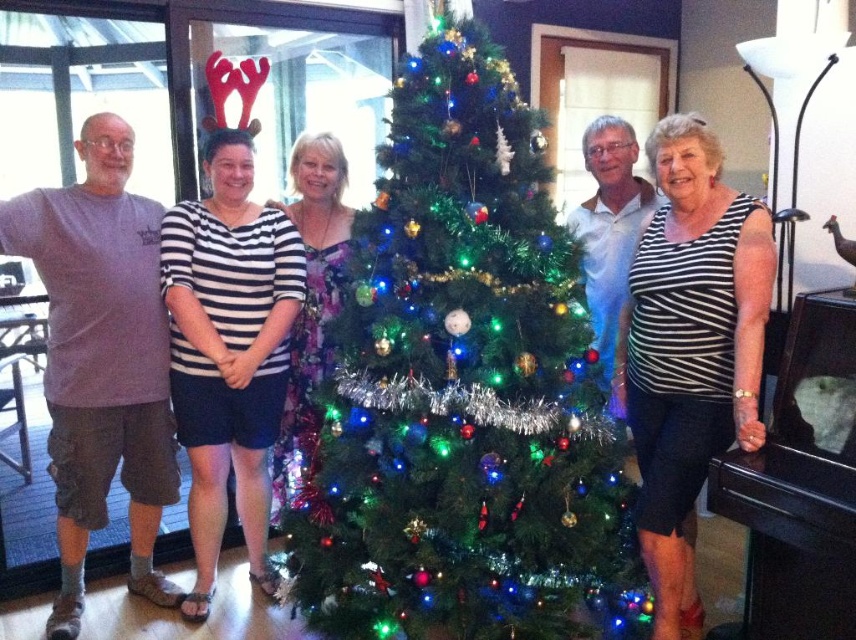
Which is above, purple cotton t-shirt at left or black striped tank top at right?

Positioned higher is purple cotton t-shirt at left.

Locate an element on the screen. The width and height of the screenshot is (856, 640). purple cotton t-shirt at left is located at coordinates (100, 358).

Locate an element on the screen. purple cotton t-shirt at left is located at coordinates (100, 358).

This screenshot has height=640, width=856. I want to click on purple cotton t-shirt at left, so (100, 358).

Is green shiny christmas tree at center thinner than striped fabric shirt at center?

No.

Looking at this image, can you confirm if green shiny christmas tree at center is positioned to the left of striped fabric shirt at center?

Incorrect, green shiny christmas tree at center is not on the left side of striped fabric shirt at center.

Where is `green shiny christmas tree at center`? This screenshot has width=856, height=640. green shiny christmas tree at center is located at coordinates (462, 390).

Is black striped tank top at right above striped fabric shirt at center?

Incorrect, black striped tank top at right is not positioned above striped fabric shirt at center.

Does black striped tank top at right have a lesser width compared to striped fabric shirt at center?

Indeed, black striped tank top at right has a lesser width compared to striped fabric shirt at center.

Is point (657, 532) positioned before point (244, 481)?

Yes, it is in front of point (244, 481).

I want to click on black striped tank top at right, so click(690, 348).